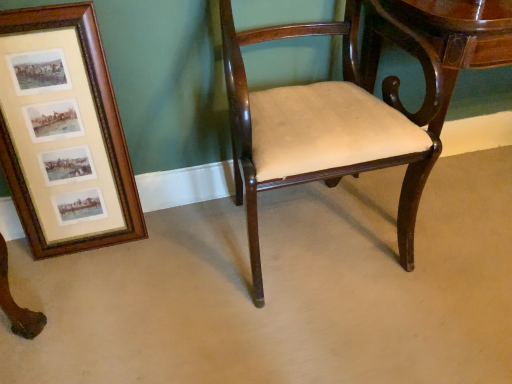
Question: Does mahogany wood chair at center appear on the right side of glossy wood table at center?

Choices:
 (A) yes
 (B) no

Answer: (B)

Question: Can you confirm if mahogany wood chair at center is thinner than glossy wood table at center?

Choices:
 (A) yes
 (B) no

Answer: (B)

Question: Is glossy wood table at center located within mahogany wood chair at center?

Choices:
 (A) no
 (B) yes

Answer: (A)

Question: Can you see mahogany wood chair at center touching glossy wood table at center?

Choices:
 (A) no
 (B) yes

Answer: (A)

Question: Is mahogany wood chair at center at the left side of glossy wood table at center?

Choices:
 (A) yes
 (B) no

Answer: (A)

Question: From a real-world perspective, is mahogany wood chair at center beneath glossy wood table at center?

Choices:
 (A) yes
 (B) no

Answer: (B)

Question: Can you confirm if mahogany wood chair at center is positioned to the right of wooden frame at left?

Choices:
 (A) yes
 (B) no

Answer: (A)

Question: Is mahogany wood chair at center oriented towards wooden frame at left?

Choices:
 (A) yes
 (B) no

Answer: (B)

Question: Is mahogany wood chair at center behind wooden frame at left?

Choices:
 (A) yes
 (B) no

Answer: (B)

Question: Is mahogany wood chair at center positioned with its back to wooden frame at left?

Choices:
 (A) yes
 (B) no

Answer: (B)

Question: Is mahogany wood chair at center thinner than wooden frame at left?

Choices:
 (A) no
 (B) yes

Answer: (A)

Question: From a real-world perspective, does mahogany wood chair at center sit lower than wooden frame at left?

Choices:
 (A) no
 (B) yes

Answer: (A)

Question: Does wooden frame at left come in front of mahogany wood chair at center?

Choices:
 (A) yes
 (B) no

Answer: (B)